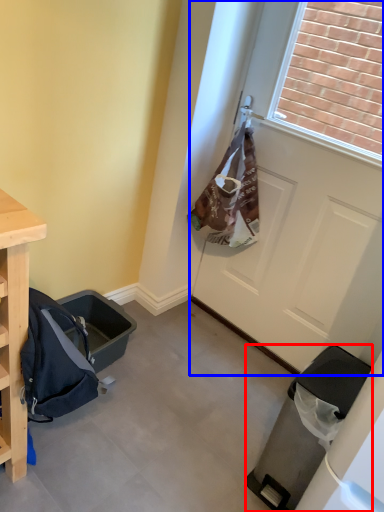
Question: Which of the following is the closest to the observer, trash bin/can (highlighted by a red box) or door (highlighted by a blue box)?

Choices:
 (A) trash bin/can
 (B) door

Answer: (A)